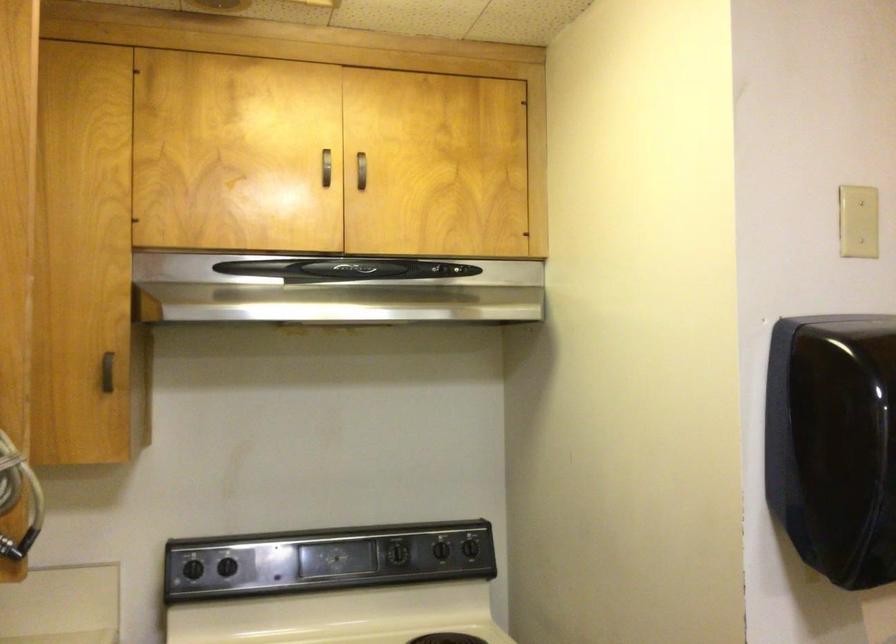
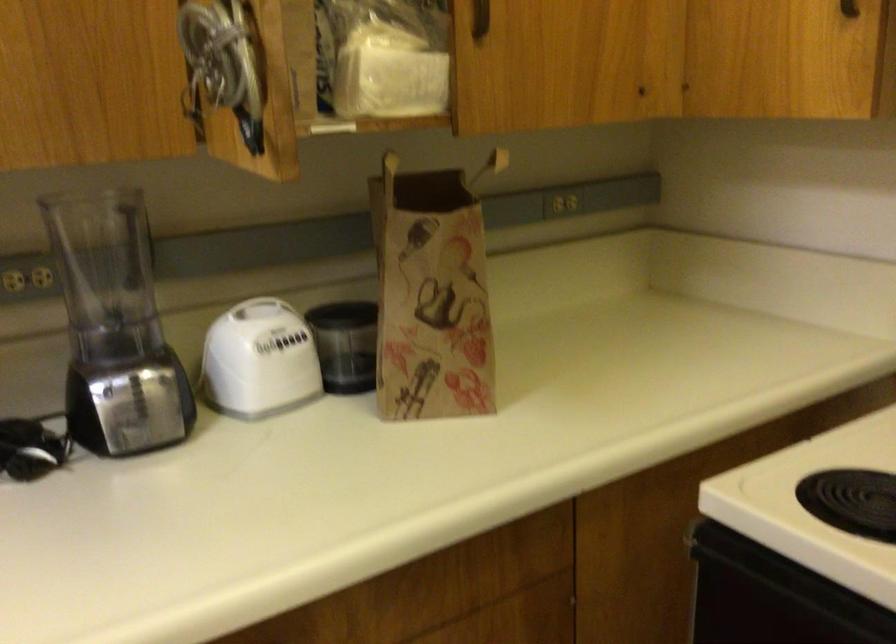
Based on the photo, how did the camera likely rotate?

The camera's rotation is toward left-down.